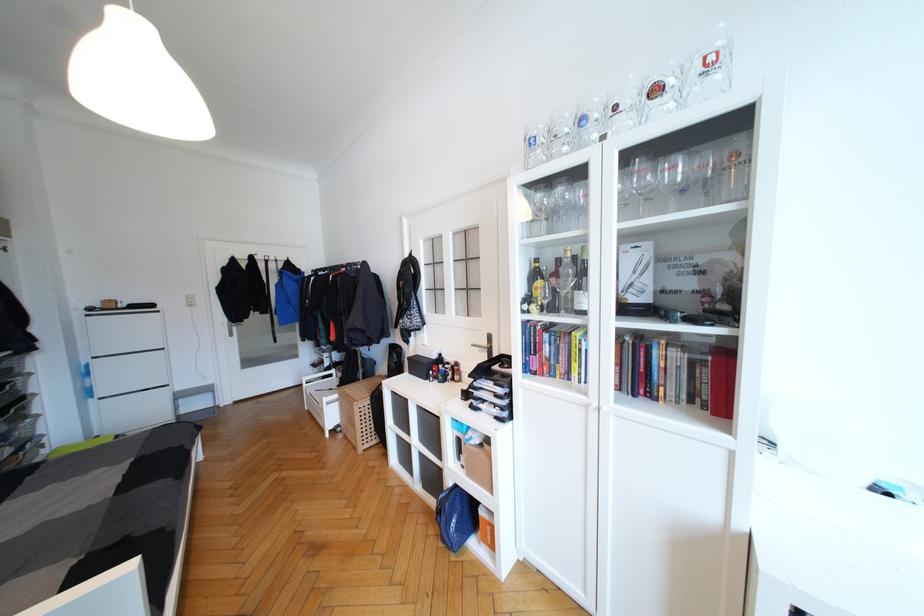
The width and height of the screenshot is (924, 616). What do you see at coordinates (418, 445) in the screenshot? I see `the grey fabric bin` at bounding box center [418, 445].